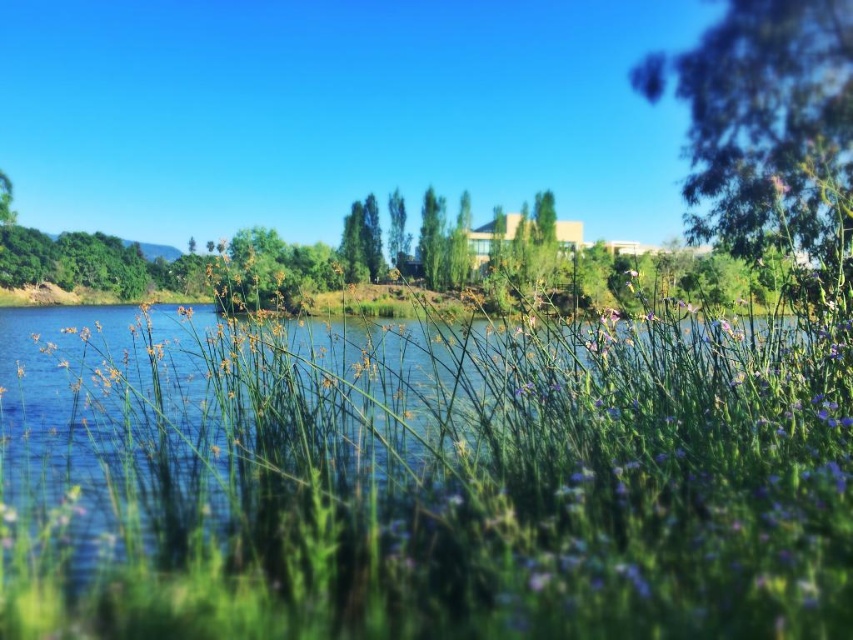
Based on the scene description, where is the green grass at center located in terms of coordinates?

The green grass at center is located at point (424, 476).

You are an artist planning to paint this scene. You want to emphasize the green leafy tree at upper right and the green leafy tree at center. Which tree should you paint larger to maintain the scene accuracy?

You should paint the green leafy tree at upper right larger than the green leafy tree at center because it is actually larger in size according to the description.